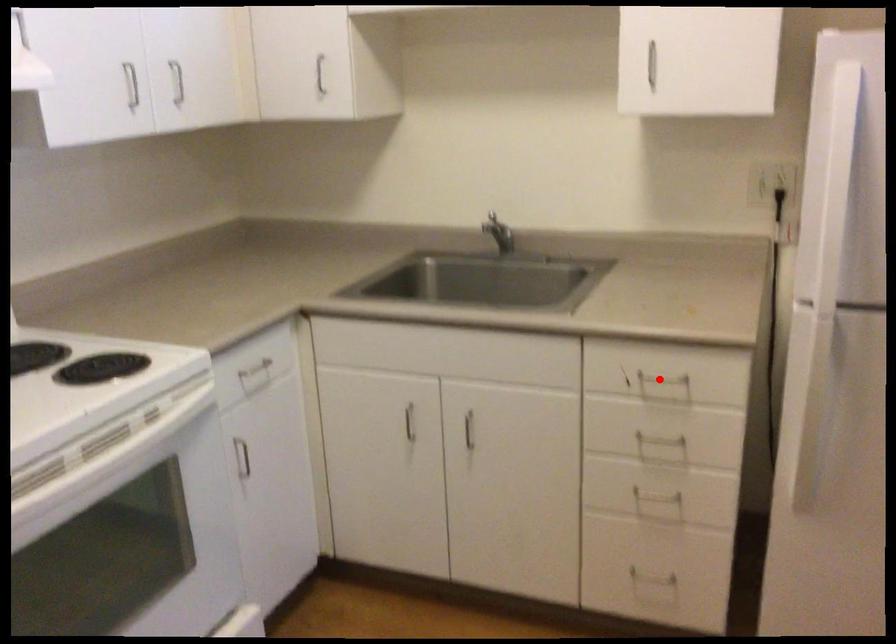
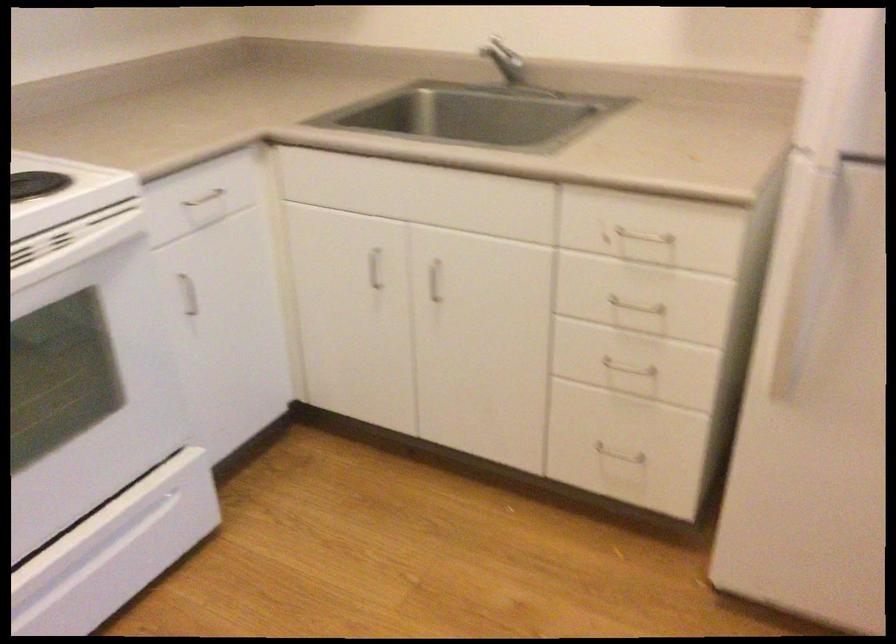
Question: A red point is marked in image1. In image2, is the corresponding 3D point closer to the camera or farther? Reply with the corresponding letter.

Choices:
 (A) The corresponding 3D point is closer.
 (B) The corresponding 3D point is farther.

Answer: (A)